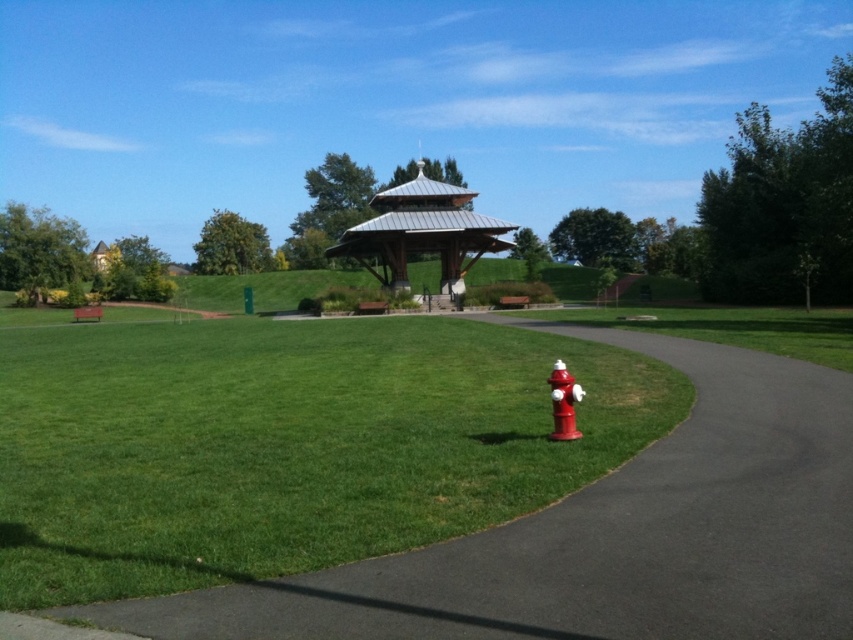
Who is taller, smooth asphalt pavement at center or metallic silver gazebo at center?

metallic silver gazebo at center is taller.

Measure the distance between smooth asphalt pavement at center and metallic silver gazebo at center.

smooth asphalt pavement at center is 46.42 meters from metallic silver gazebo at center.

Is point (741, 598) behind point (442, 237)?

No.

Where is `smooth asphalt pavement at center`? smooth asphalt pavement at center is located at coordinates (601, 536).

Between smooth asphalt pavement at center and shiny red fire hydrant at lower right, which one is positioned higher?

shiny red fire hydrant at lower right is higher up.

Is point (604, 500) positioned in front of point (550, 396)?

Yes, point (604, 500) is in front of point (550, 396).

Identify the location of smooth asphalt pavement at center. This screenshot has height=640, width=853. (601, 536).

Which is behind, point (419, 164) or point (561, 371)?

The point (419, 164) is behind.

Is point (471, 195) positioned after point (566, 412)?

Yes, point (471, 195) is farther from viewer.

The height and width of the screenshot is (640, 853). I want to click on metallic silver gazebo at center, so click(x=422, y=232).